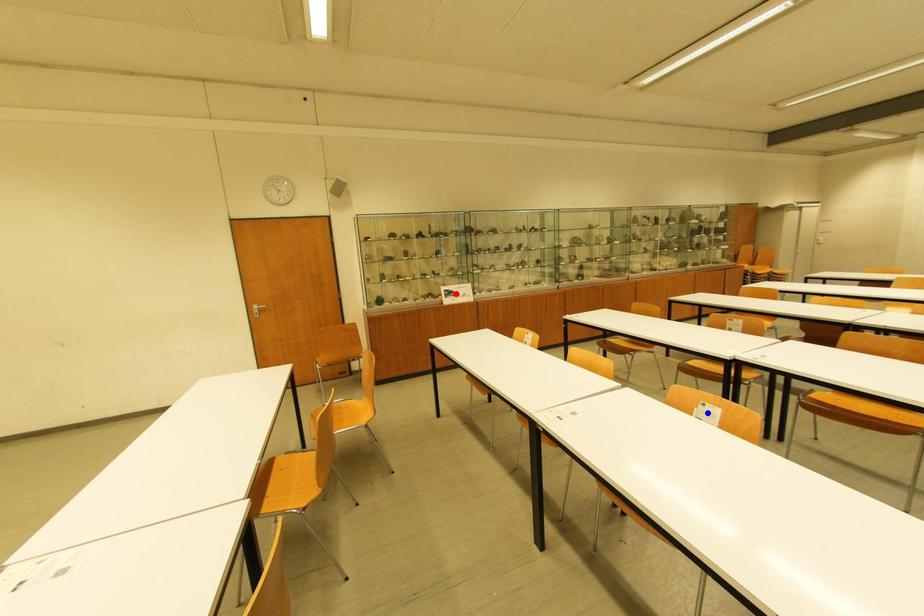
Question: Which of the two points in the image is closer to the camera?

Choices:
 (A) Blue point is closer.
 (B) Red point is closer.

Answer: (A)